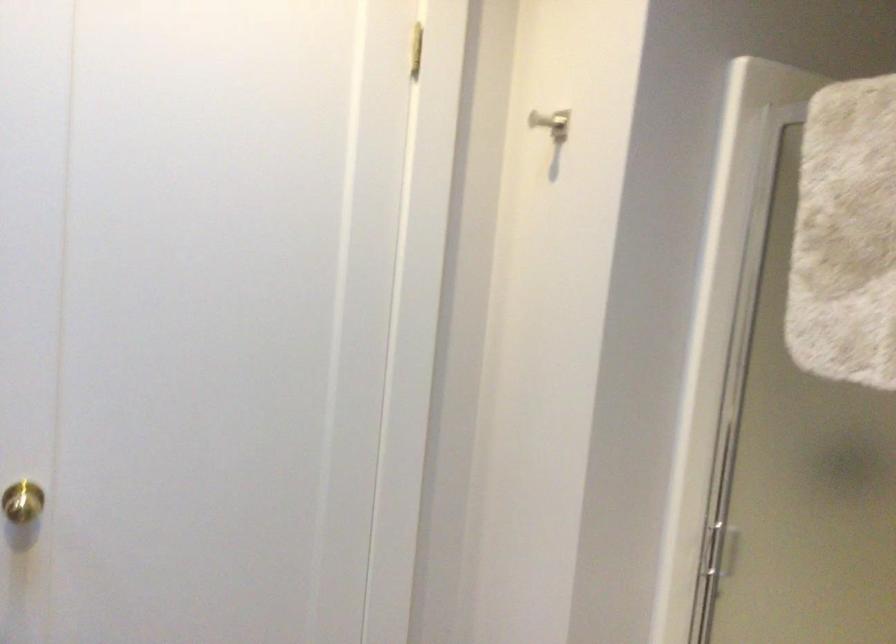
Find where to pull the gold door knob. Please return your answer as a coordinate pair (x, y).

(22, 502)